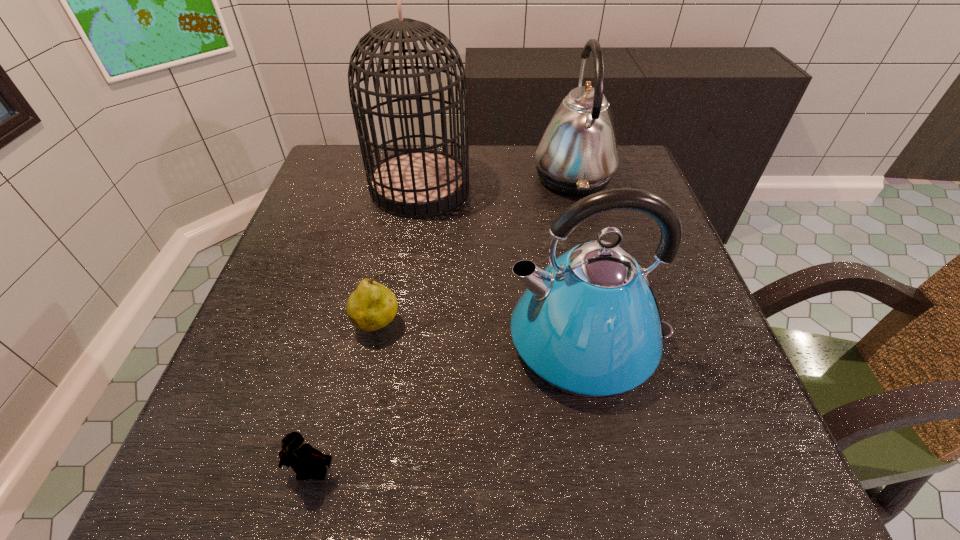
Locate an element on the screen. The height and width of the screenshot is (540, 960). vacant area located at the spout of the nearer kettle is located at coordinates (308, 341).

I want to click on free space located at the spout of the nearer kettle, so click(x=433, y=341).

This screenshot has height=540, width=960. I want to click on vacant area located at the spout of the nearer kettle, so click(x=410, y=341).

Where is `vacant space located on the back of the second shortest object`? vacant space located on the back of the second shortest object is located at coordinates (404, 195).

The width and height of the screenshot is (960, 540). What are the coordinates of `birdcage positioned at the far edge` in the screenshot? It's located at (413, 183).

Find the location of a particular element. The height and width of the screenshot is (540, 960). kettle that is at the far edge is located at coordinates (577, 154).

Locate an element on the screen. object that is at the near edge is located at coordinates (304, 459).

Locate an element on the screen. The image size is (960, 540). birdcage located at the left edge is located at coordinates (413, 183).

Where is `Lego situated at the left edge`? Image resolution: width=960 pixels, height=540 pixels. Lego situated at the left edge is located at coordinates (304, 459).

Find the location of a particular element. This screenshot has width=960, height=540. object that is positioned at the far left corner is located at coordinates (413, 183).